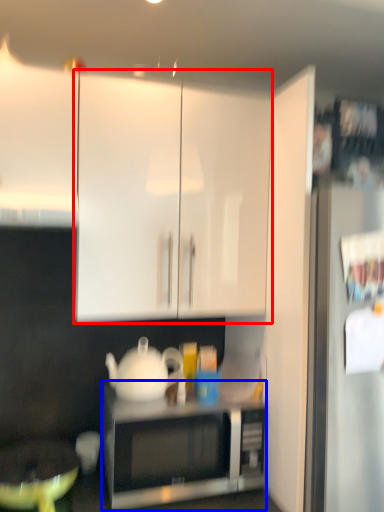
Question: Which object is closer to the camera taking this photo, cabinetry (highlighted by a red box) or microwave oven (highlighted by a blue box)?

Choices:
 (A) cabinetry
 (B) microwave oven

Answer: (A)